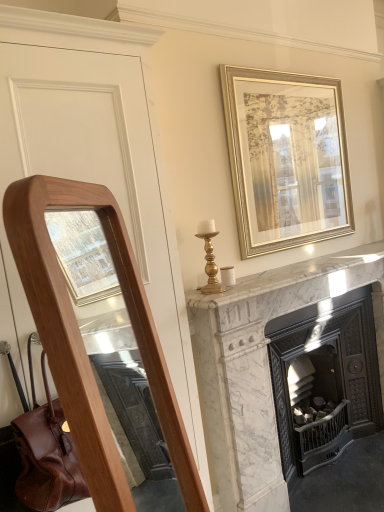
Question: Is white marble fireplace at center oriented towards gold metallic picture frame at upper center?

Choices:
 (A) yes
 (B) no

Answer: (B)

Question: Can you confirm if white marble fireplace at center is thinner than gold metallic picture frame at upper center?

Choices:
 (A) no
 (B) yes

Answer: (A)

Question: Can you confirm if white marble fireplace at center is bigger than gold metallic picture frame at upper center?

Choices:
 (A) no
 (B) yes

Answer: (B)

Question: Is white marble fireplace at center positioned behind gold metallic picture frame at upper center?

Choices:
 (A) no
 (B) yes

Answer: (A)

Question: Is white marble fireplace at center to the right of gold metallic picture frame at upper center from the viewer's perspective?

Choices:
 (A) yes
 (B) no

Answer: (A)

Question: Is white marble fireplace at center closer to the viewer compared to gold metallic picture frame at upper center?

Choices:
 (A) yes
 (B) no

Answer: (A)

Question: Does gold metallic picture frame at upper center appear on the right side of white marble fireplace at center?

Choices:
 (A) no
 (B) yes

Answer: (A)

Question: Can you confirm if gold metallic picture frame at upper center is bigger than white marble fireplace at center?

Choices:
 (A) yes
 (B) no

Answer: (B)

Question: From a real-world perspective, is gold metallic picture frame at upper center located beneath white marble fireplace at center?

Choices:
 (A) yes
 (B) no

Answer: (B)

Question: Are gold metallic picture frame at upper center and white marble fireplace at center making contact?

Choices:
 (A) yes
 (B) no

Answer: (B)

Question: Does gold metallic picture frame at upper center have a greater height compared to white marble fireplace at center?

Choices:
 (A) no
 (B) yes

Answer: (A)

Question: From a real-world perspective, is gold metallic picture frame at upper center on white marble fireplace at center?

Choices:
 (A) no
 (B) yes

Answer: (B)

Question: Is white marble fireplace at center wider or thinner than gold metallic picture frame at upper center?

Choices:
 (A) wide
 (B) thin

Answer: (A)